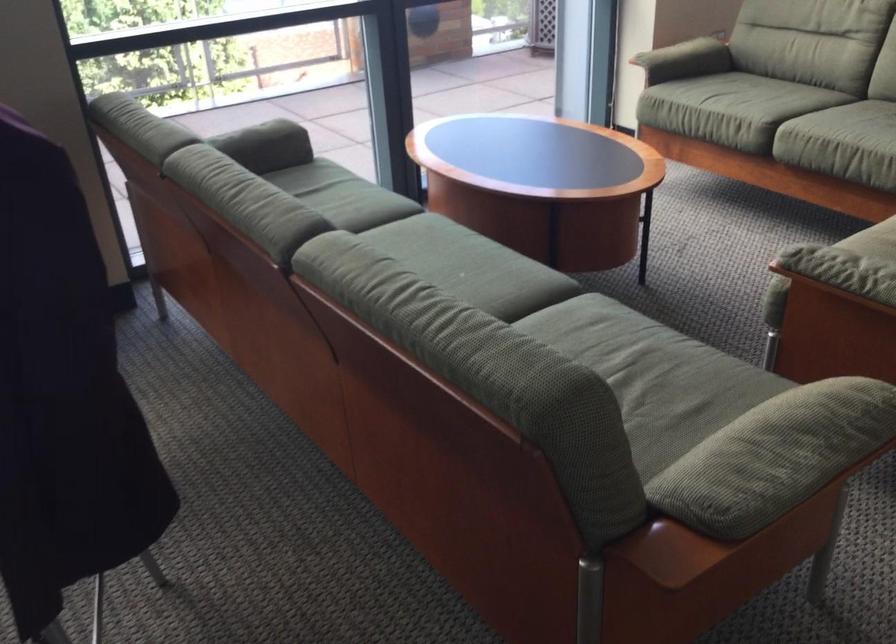
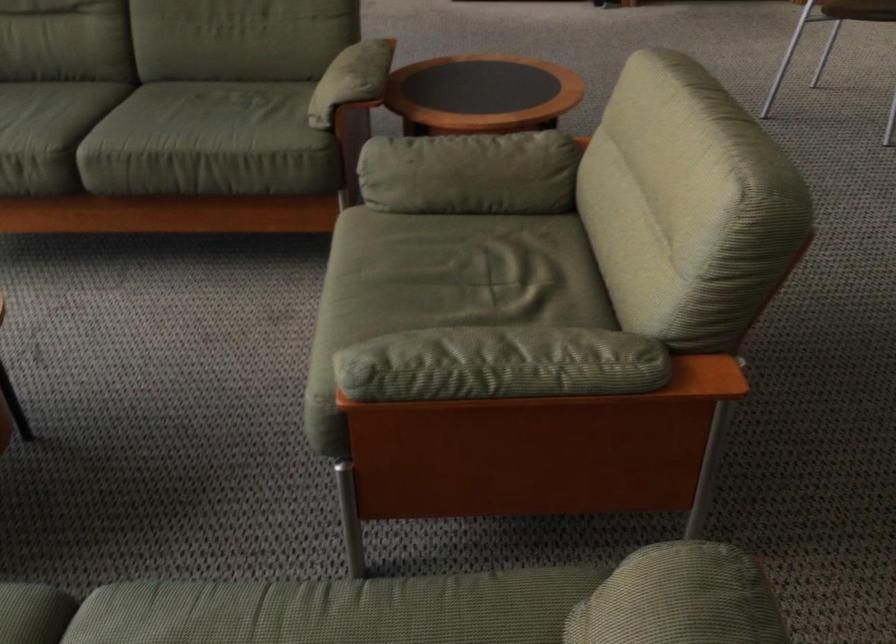
Question: The camera is either moving clockwise (left) or counter-clockwise (right) around the object. The first image is from the beginning of the video and the second image is from the end. Is the camera moving left or right when shooting the video?

Choices:
 (A) Left
 (B) Right

Answer: (A)